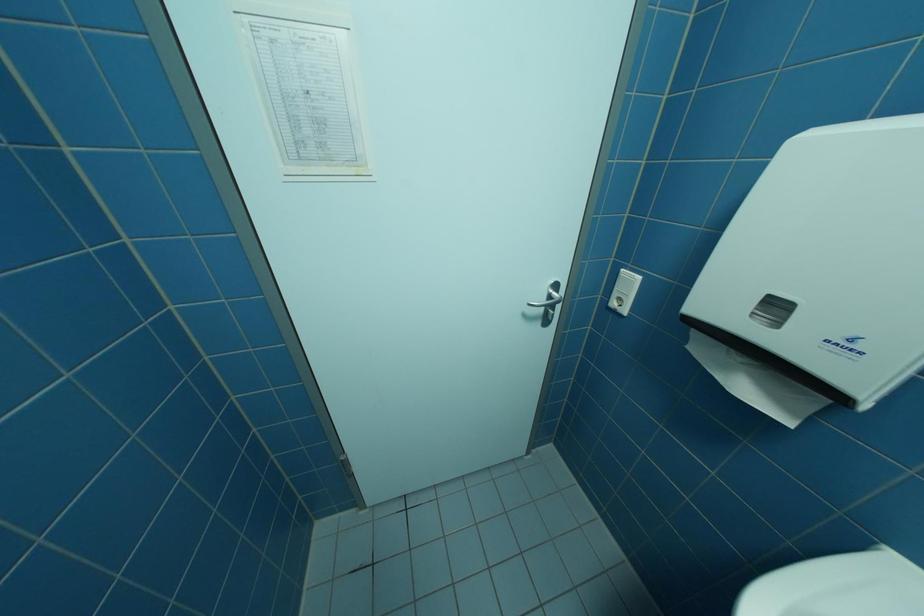
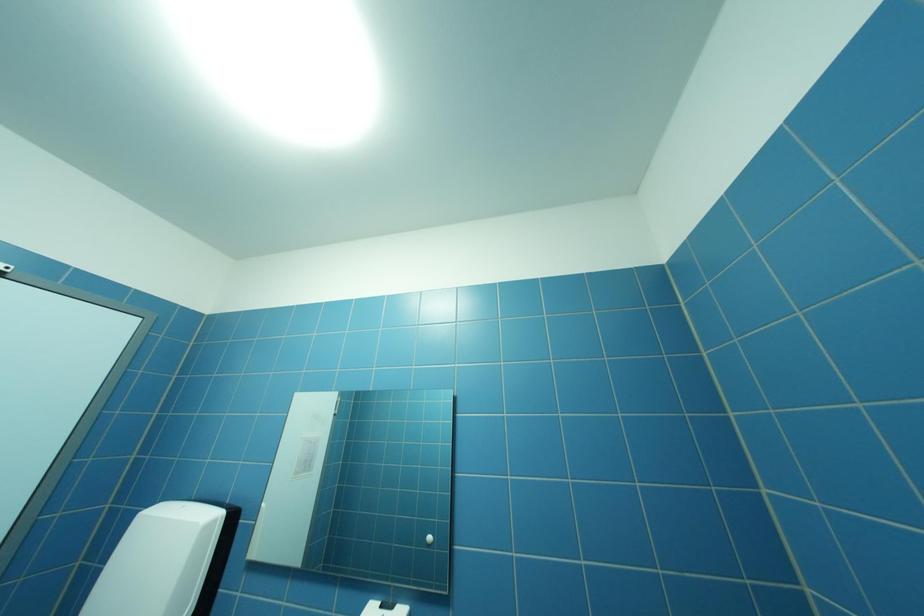
First-person continuous shooting, in which direction is the camera rotating?

The camera rotated toward right-up.